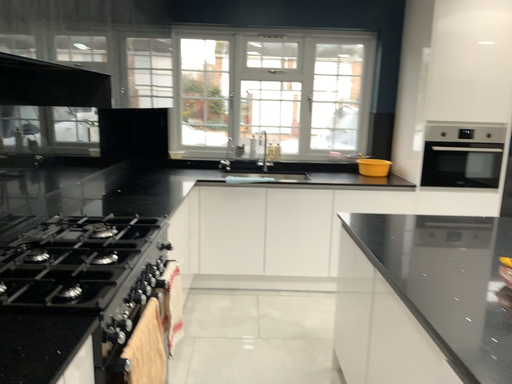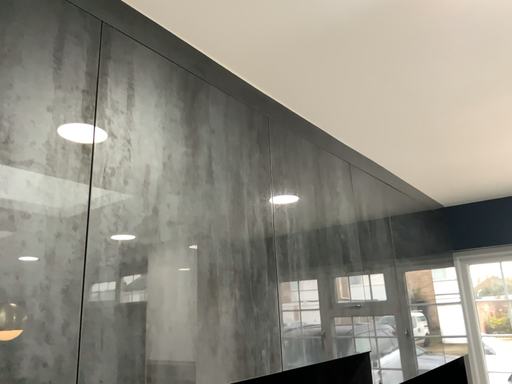
Question: Which way did the camera rotate in the video?

Choices:
 (A) rotated left
 (B) rotated right

Answer: (A)